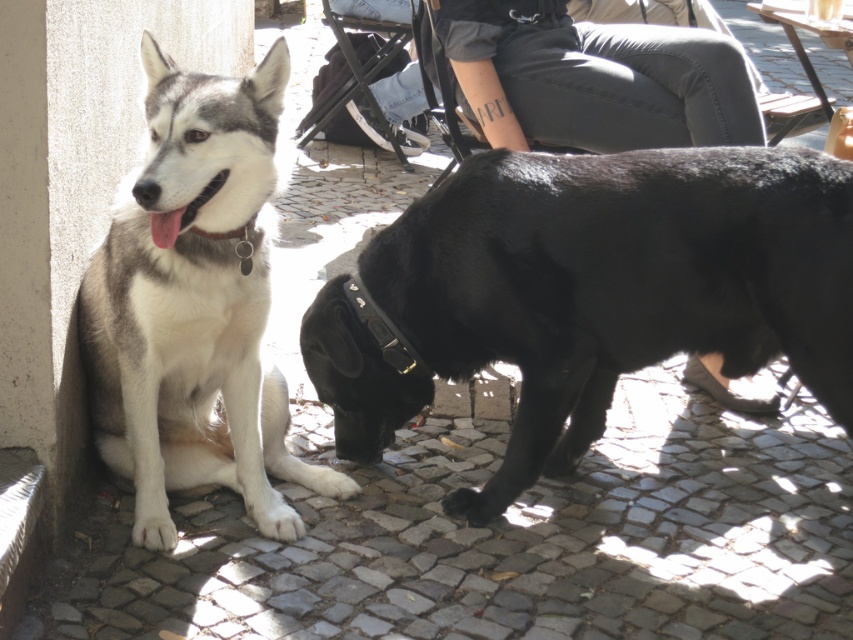
Does gray-white fur dog at left have a greater width compared to gray denim pants at center?

In fact, gray-white fur dog at left might be narrower than gray denim pants at center.

Is gray-white fur dog at left shorter than gray denim pants at center?

No, gray-white fur dog at left is not shorter than gray denim pants at center.

Find the location of a particular element. gray-white fur dog at left is located at coordinates (194, 307).

I want to click on gray-white fur dog at left, so click(x=194, y=307).

Between black smooth dog at lower right and gray-white fur dog at left, which one has more height?

gray-white fur dog at left is taller.

Does black smooth dog at lower right have a greater height compared to gray-white fur dog at left?

Incorrect, black smooth dog at lower right's height is not larger of gray-white fur dog at left's.

Does point (741, 342) lie in front of point (151, 477)?

No, (741, 342) is further to viewer.

Identify the location of black smooth dog at lower right. The height and width of the screenshot is (640, 853). (590, 292).

Is point (606, 161) behind point (500, 140)?

No, it is in front of (500, 140).

Between point (430, 228) and point (560, 128), which one is positioned behind?

The point (560, 128) is more distant.

Who is more distant from viewer, (773, 330) or (564, 88)?

The point (564, 88) is more distant.

At what (x,y) coordinates should I click in order to perform the action: click on black smooth dog at lower right. Please return your answer as a coordinate pair (x, y). This screenshot has width=853, height=640. Looking at the image, I should click on (590, 292).